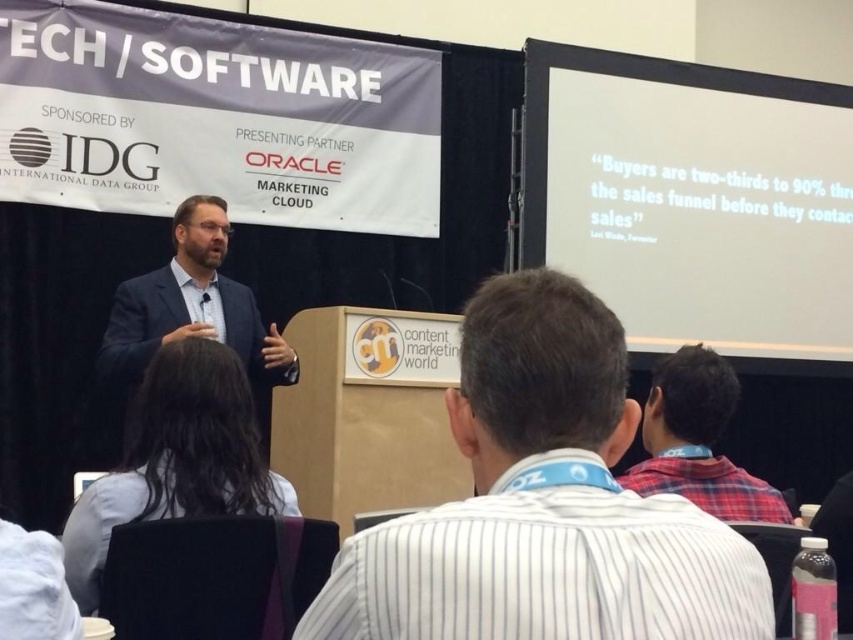
Question: Where is white striped shirt at center located in relation to red plaid shirt at upper right in the image?

Choices:
 (A) left
 (B) right

Answer: (A)

Question: Is white striped shirt at center to the left of red plaid shirt at upper right from the viewer's perspective?

Choices:
 (A) no
 (B) yes

Answer: (B)

Question: Is light blue shirt at lower left wider than matte blue suit at center?

Choices:
 (A) yes
 (B) no

Answer: (B)

Question: Which object is farther from the camera taking this photo?

Choices:
 (A) red plaid shirt at upper right
 (B) white striped shirt at center
 (C) matte blue suit at center
 (D) light blue shirt at lower left

Answer: (C)

Question: Among these points, which one is farthest from the camera?

Choices:
 (A) (590, 314)
 (B) (706, 388)

Answer: (B)

Question: Which of the following is the farthest from the observer?

Choices:
 (A) click(x=351, y=608)
 (B) click(x=183, y=298)
 (C) click(x=73, y=531)
 (D) click(x=663, y=403)

Answer: (B)